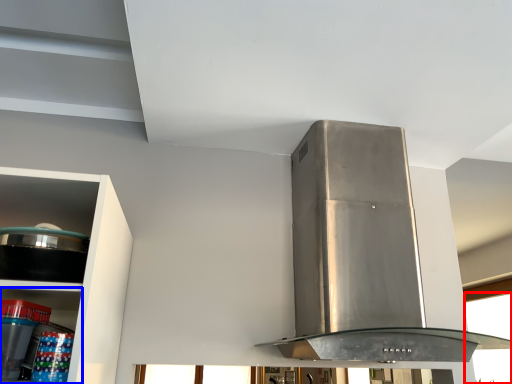
Question: Which point is further to the camera, window (highlighted by a red box) or shelf (highlighted by a blue box)?

Choices:
 (A) window
 (B) shelf

Answer: (A)